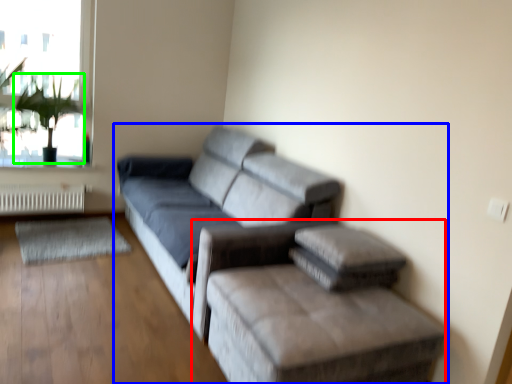
Question: Which is nearer to the furniture (highlighted by a red box)? studio couch (highlighted by a blue box) or plant (highlighted by a green box).

Choices:
 (A) studio couch
 (B) plant

Answer: (A)